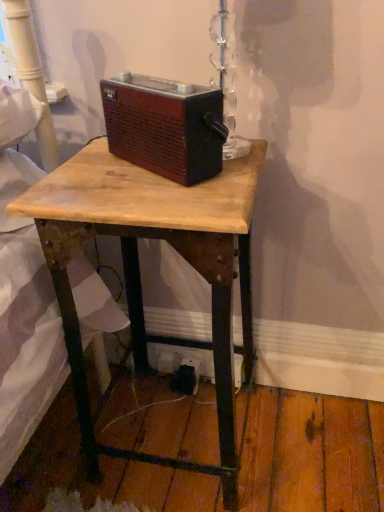
Where is `vacant space in front of black plastic outlet at lower center`? This screenshot has height=512, width=384. vacant space in front of black plastic outlet at lower center is located at coordinates (192, 431).